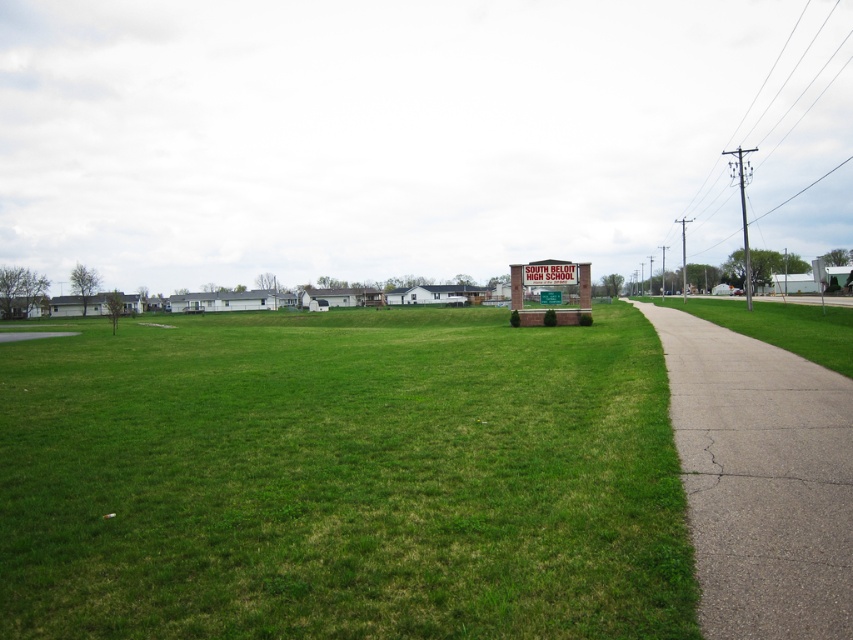
Who is more distant from viewer, (114, 440) or (675, 445)?

A: The point (114, 440) is more distant.

Does point (460, 550) lie in front of point (735, 518)?

Yes, point (460, 550) is in front of point (735, 518).

Between point (448, 385) and point (711, 625), which one is positioned in front?

Point (711, 625)

The image size is (853, 640). Find the location of `green grassy field at center`. green grassy field at center is located at coordinates (341, 480).

The image size is (853, 640). Describe the element at coordinates (761, 480) in the screenshot. I see `gray asphalt sidewalk at right` at that location.

Is point (676, 390) closer to viewer compared to point (820, 339)?

Yes, it is.

Find the location of a particular element. The width and height of the screenshot is (853, 640). gray asphalt sidewalk at right is located at coordinates (761, 480).

Can you confirm if green grass at lower right is positioned to the left of green painted metal sign at center?

In fact, green grass at lower right is to the right of green painted metal sign at center.

This screenshot has height=640, width=853. Find the location of `green grass at lower right`. green grass at lower right is located at coordinates (780, 324).

This screenshot has height=640, width=853. I want to click on green grass at lower right, so click(780, 324).